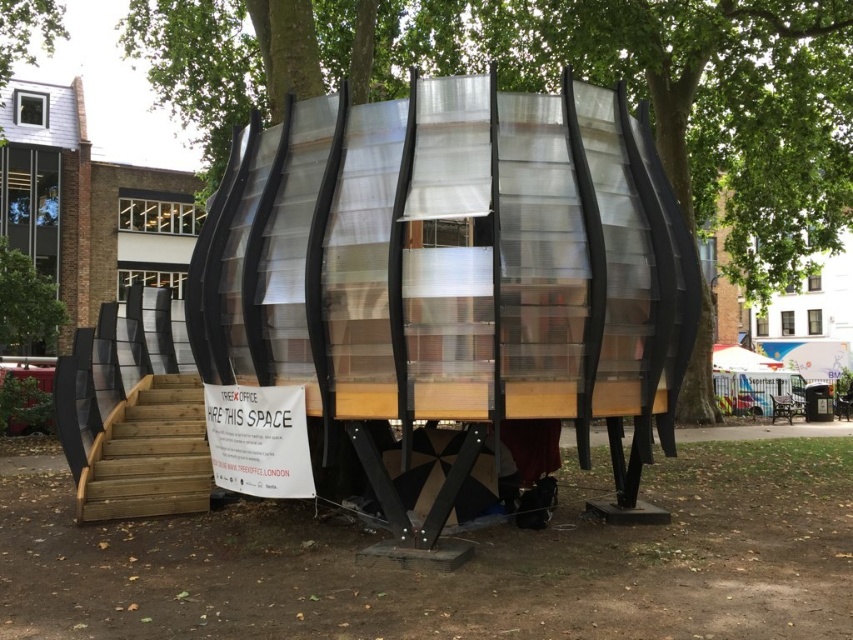
You are standing at the origin point of the coordinate system in the park. You want to locate the transparent plastic structure at center. What are its coordinates?

The transparent plastic structure at center is located at coordinates point (451, 269).

You are standing at the base of the staircase and want to walk towards the transparent plastic structure at center. Which direction should you turn to face the metallic silver hut at upper center?

To face the metallic silver hut at upper center, you should turn to your left since the transparent plastic structure at center is to the right of the metallic silver hut at upper center.

You are planning to host an outdoor event and want to set up a booth. You have a transparent plastic structure at center and a metallic silver hut at upper center available. Which one would provide better shelter from rain?

The metallic silver hut at upper center would provide better shelter from rain because the transparent plastic structure at center is positioned under it, meaning the hut is above and can offer coverage.